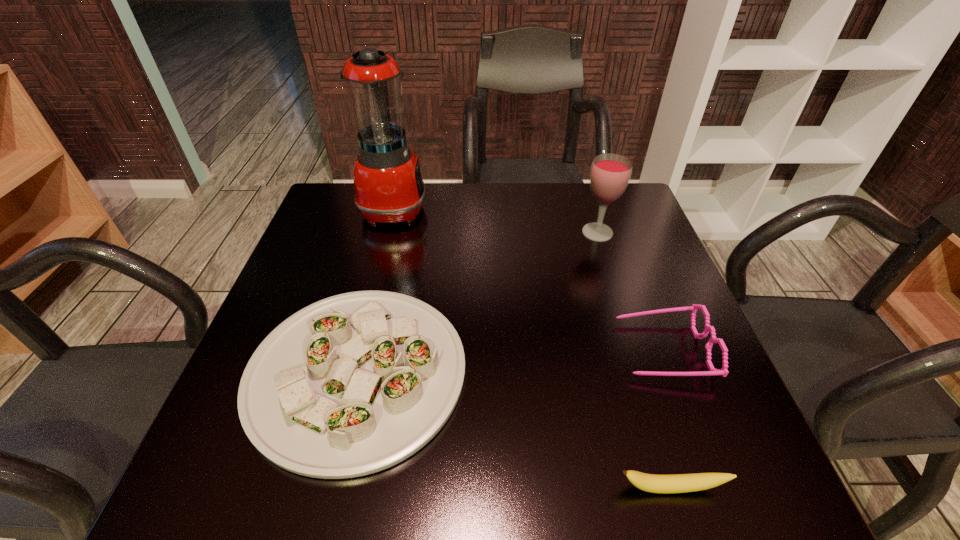
Where is `food processor`? Image resolution: width=960 pixels, height=540 pixels. food processor is located at coordinates (388, 184).

The width and height of the screenshot is (960, 540). Identify the location of wineglass. (610, 174).

The height and width of the screenshot is (540, 960). In order to click on spectacles in this screenshot , I will do `click(724, 372)`.

I want to click on platter, so click(353, 384).

Find the location of a particular element. Image resolution: width=960 pixels, height=540 pixels. the shortest object is located at coordinates (680, 483).

Find the location of `free space located 0.260m on the controls of the food processor`. free space located 0.260m on the controls of the food processor is located at coordinates (519, 208).

Locate an element on the screen. vacant region located on the front of the second tallest object is located at coordinates (612, 279).

In order to click on vacant space located on the arms of the spectacles in this screenshot , I will do `click(577, 349)`.

The image size is (960, 540). Find the location of `vacant space located on the arms of the spectacles`. vacant space located on the arms of the spectacles is located at coordinates (526, 349).

I want to click on vacant space located 0.350m on the arms of the spectacles, so click(445, 349).